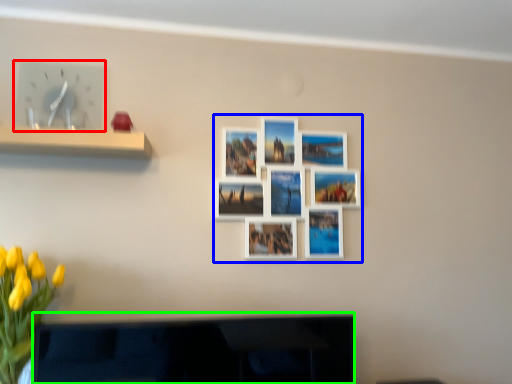
Question: Estimate the real-world distances between objects in this image. Which object is farther from clock (highlighted by a red box), decorative picture (highlighted by a blue box) or television (highlighted by a green box)?

Choices:
 (A) decorative picture
 (B) television

Answer: (B)